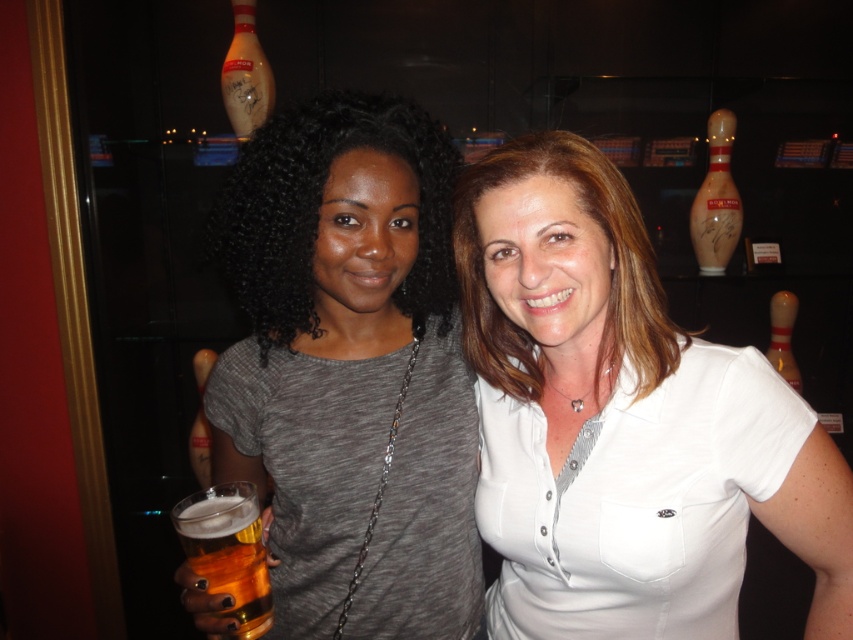
Question: Which of the following is the farthest from the observer?

Choices:
 (A) gray heathered shirt at center
 (B) white glossy shirt at center

Answer: (A)

Question: Does white glossy shirt at center lie in front of golden amber liquid at lower left?

Choices:
 (A) yes
 (B) no

Answer: (A)

Question: Estimate the real-world distances between objects in this image. Which object is closer to the white glossy shirt at center?

Choices:
 (A) golden amber liquid at lower left
 (B) gray heathered shirt at center

Answer: (B)

Question: Among these points, which one is nearest to the camera?

Choices:
 (A) (270, 621)
 (B) (399, 348)
 (C) (491, 230)

Answer: (C)

Question: Can you confirm if white glossy shirt at center is thinner than gray heathered shirt at center?

Choices:
 (A) yes
 (B) no

Answer: (B)

Question: Does white glossy shirt at center appear on the right side of gray heathered shirt at center?

Choices:
 (A) yes
 (B) no

Answer: (A)